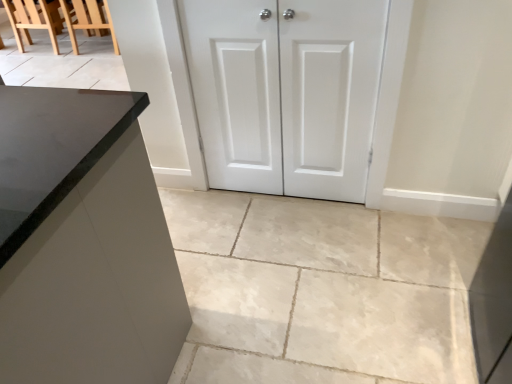
Question: Is white matte cabinet doors at center completely or partially inside slate gray stone countertop at left?

Choices:
 (A) no
 (B) yes

Answer: (A)

Question: Can you confirm if slate gray stone countertop at left is positioned to the left of white matte cabinet doors at center?

Choices:
 (A) yes
 (B) no

Answer: (A)

Question: From the image's perspective, is slate gray stone countertop at left beneath white matte cabinet doors at center?

Choices:
 (A) yes
 (B) no

Answer: (A)

Question: Does slate gray stone countertop at left have a smaller size compared to white matte cabinet doors at center?

Choices:
 (A) no
 (B) yes

Answer: (A)

Question: Is slate gray stone countertop at left bigger than white matte cabinet doors at center?

Choices:
 (A) no
 (B) yes

Answer: (B)

Question: In terms of size, does white matte cabinet doors at center appear bigger or smaller than white matte cabinet doors at center?

Choices:
 (A) big
 (B) small

Answer: (A)

Question: In terms of width, does white matte cabinet doors at center look wider or thinner when compared to white matte cabinet doors at center?

Choices:
 (A) wide
 (B) thin

Answer: (A)

Question: From the image's perspective, is white matte cabinet doors at center positioned above or below white matte cabinet doors at center?

Choices:
 (A) below
 (B) above

Answer: (A)

Question: Would you say white matte cabinet doors at center is to the left or to the right of white matte cabinet doors at center in the picture?

Choices:
 (A) right
 (B) left

Answer: (A)

Question: From the image's perspective, is wooden chair at upper left, marked as the first chair in a right-to-left arrangement, above or below wooden chair at upper left, which is counted as the 2th chair, starting from the right?

Choices:
 (A) below
 (B) above

Answer: (B)

Question: From a real-world perspective, is wooden chair at upper left, arranged as the 2th chair when viewed from the left, above or below wooden chair at upper left, which is counted as the 2th chair, starting from the right?

Choices:
 (A) below
 (B) above

Answer: (B)

Question: Based on their sizes in the image, would you say wooden chair at upper left, arranged as the 2th chair when viewed from the left, is bigger or smaller than wooden chair at upper left, which is counted as the 2th chair, starting from the right?

Choices:
 (A) small
 (B) big

Answer: (B)

Question: Is point (35, 11) positioned closer to the camera than point (8, 9)?

Choices:
 (A) closer
 (B) farther

Answer: (A)

Question: Do you think slate gray stone countertop at left is within white matte cabinet doors at center, or outside of it?

Choices:
 (A) inside
 (B) outside

Answer: (B)

Question: From a real-world perspective, is slate gray stone countertop at left physically located above or below white matte cabinet doors at center?

Choices:
 (A) below
 (B) above

Answer: (B)